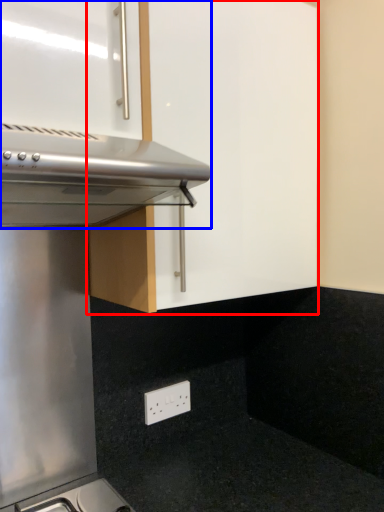
Question: Which object appears farthest to the camera in this image, cabinetry (highlighted by a red box) or oven (highlighted by a blue box)?

Choices:
 (A) cabinetry
 (B) oven

Answer: (A)